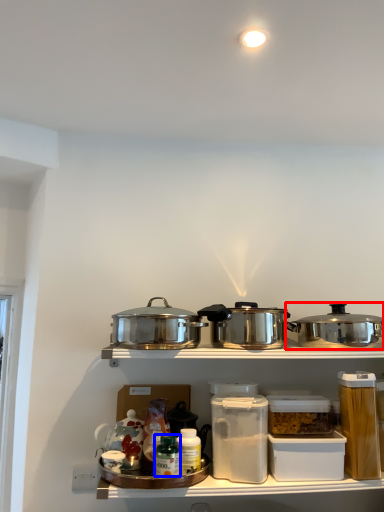
Question: Which of the following is the farthest to the observer, kitchen appliance (highlighted by a red box) or bottle (highlighted by a blue box)?

Choices:
 (A) kitchen appliance
 (B) bottle

Answer: (A)